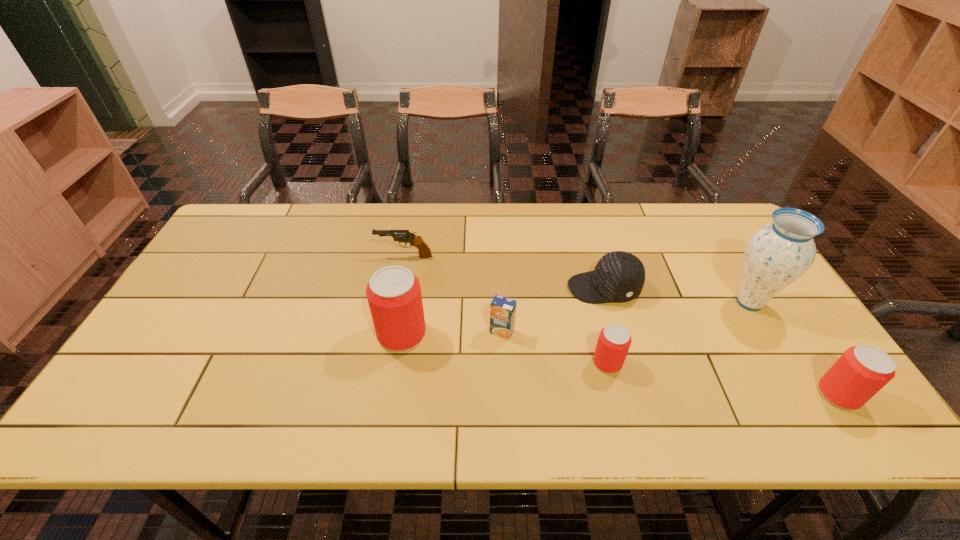
Where is `vacant space that satisfies the following two spatial constraints: 1. on the front side of the second shortest beer can; 2. on the right side of the leftmost beer can`? The width and height of the screenshot is (960, 540). vacant space that satisfies the following two spatial constraints: 1. on the front side of the second shortest beer can; 2. on the right side of the leftmost beer can is located at coordinates (392, 394).